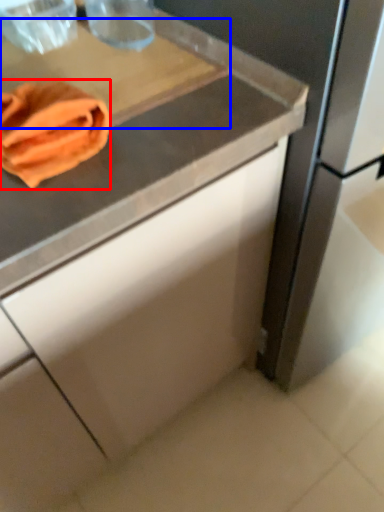
Question: Which object is closer to the camera taking this photo, material (highlighted by a red box) or cutting board (highlighted by a blue box)?

Choices:
 (A) material
 (B) cutting board

Answer: (A)